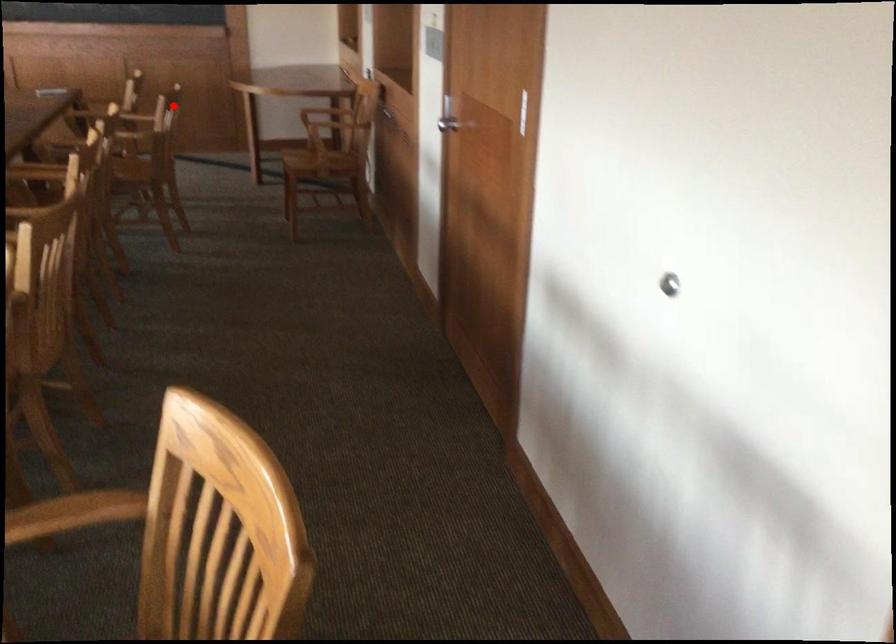
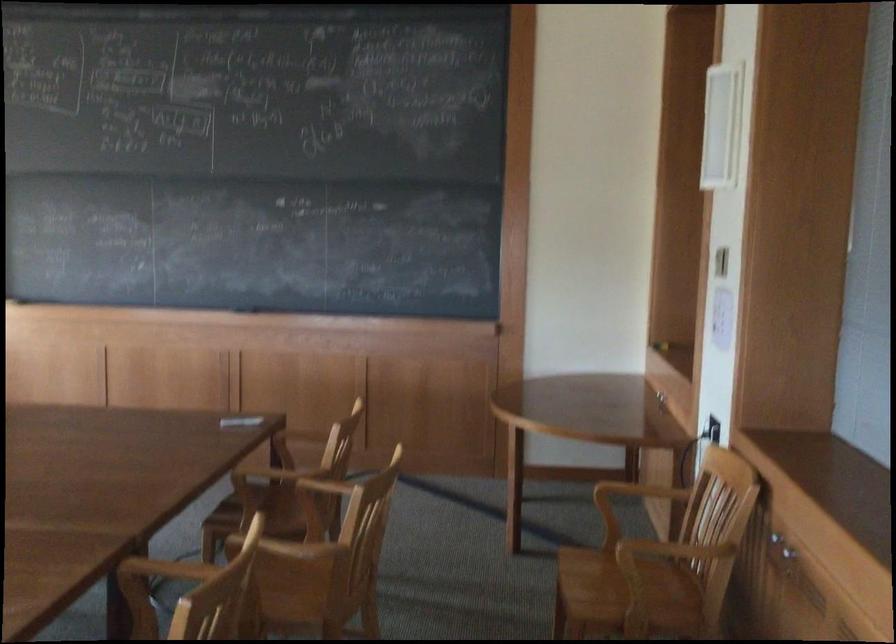
Question: A red point is marked in image1. In image2, is the corresponding 3D point closer to the camera or farther? Reply with the corresponding letter.

Choices:
 (A) The corresponding 3D point is closer.
 (B) The corresponding 3D point is farther.

Answer: (A)